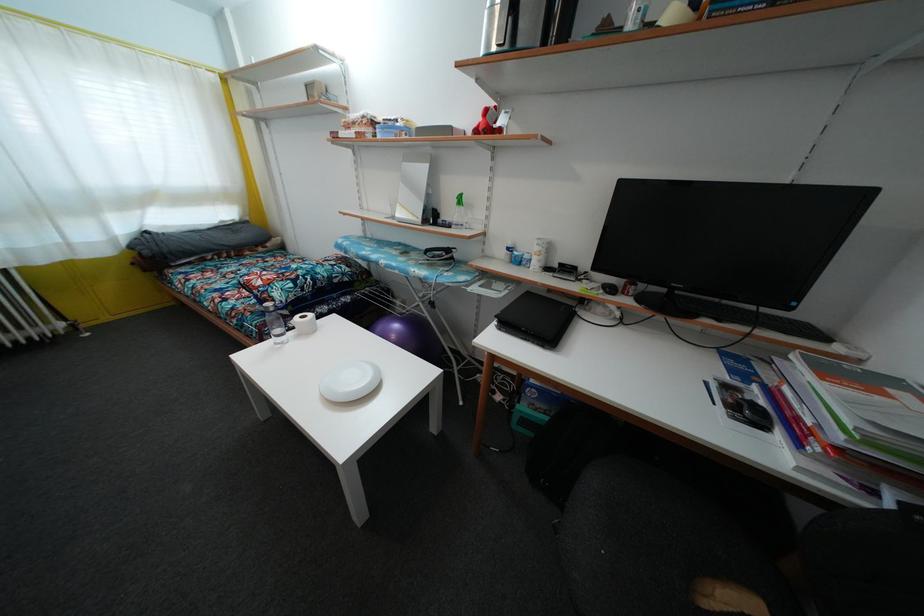
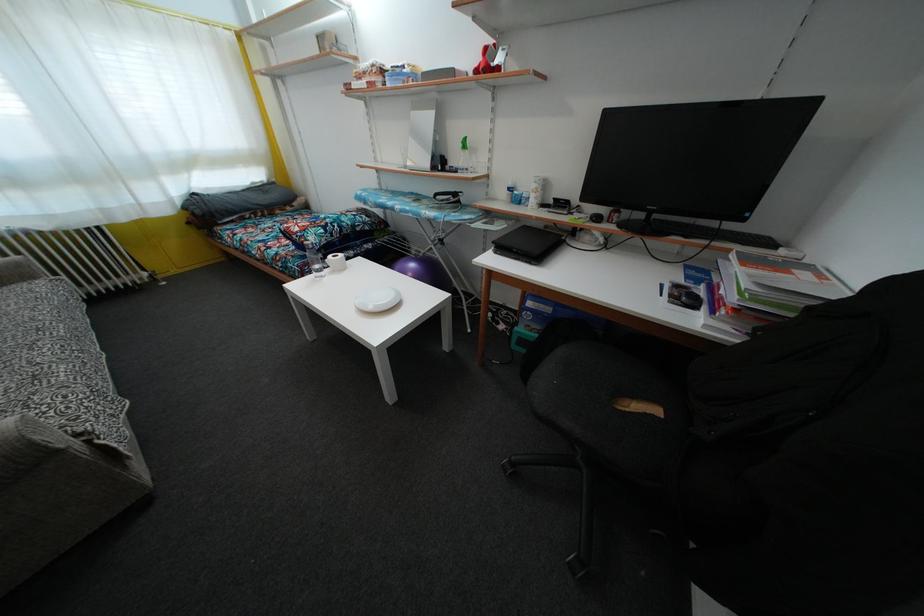
The point at [490,119] is marked in the first image. Where is the corresponding point in the second image?

(490, 58)